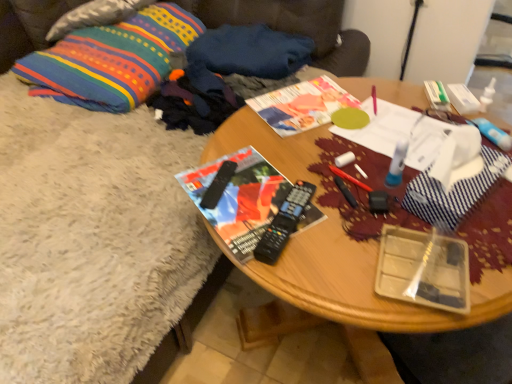
Locate an element on the screen. This screenshot has width=512, height=384. vacant region above matte paper magazine at center (from a real-world perspective) is located at coordinates (306, 103).